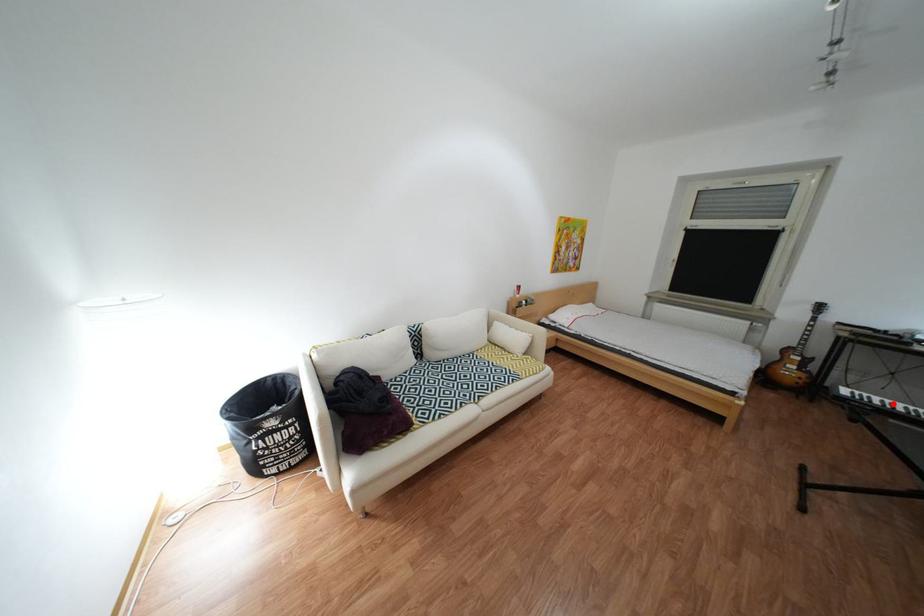
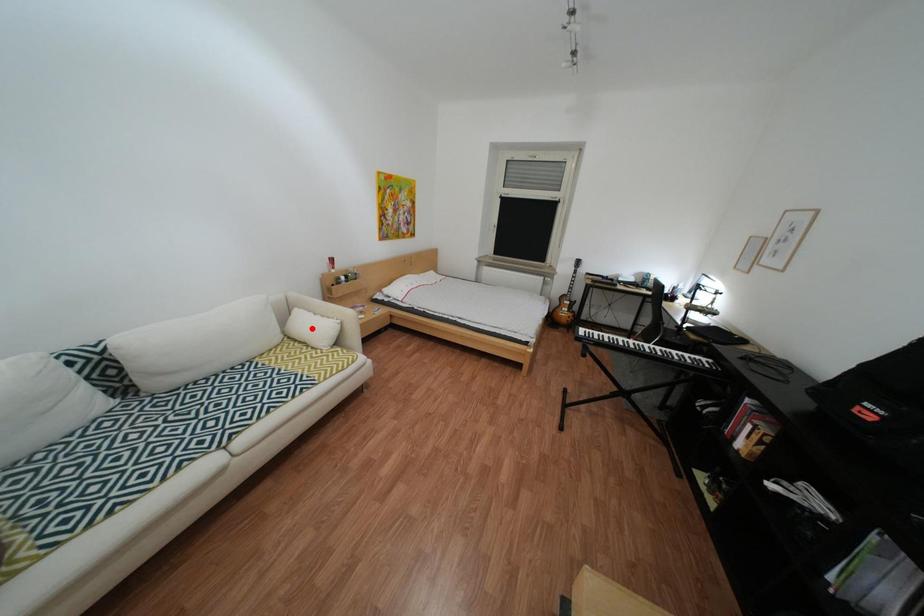
I am providing you with two images of the same scene from different viewpoints. A red point is marked on the first image and another point is marked on the second image. Do the highlighted points in image1 and image2 indicate the same real-world spot?

No